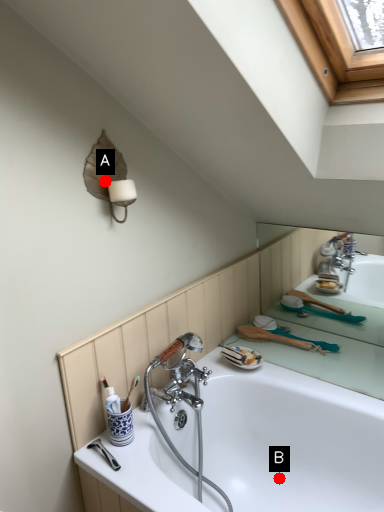
Question: Two points are circled on the image, labeled by A and B beside each circle. Which point is closer to the camera?

Choices:
 (A) A is closer
 (B) B is closer

Answer: (A)